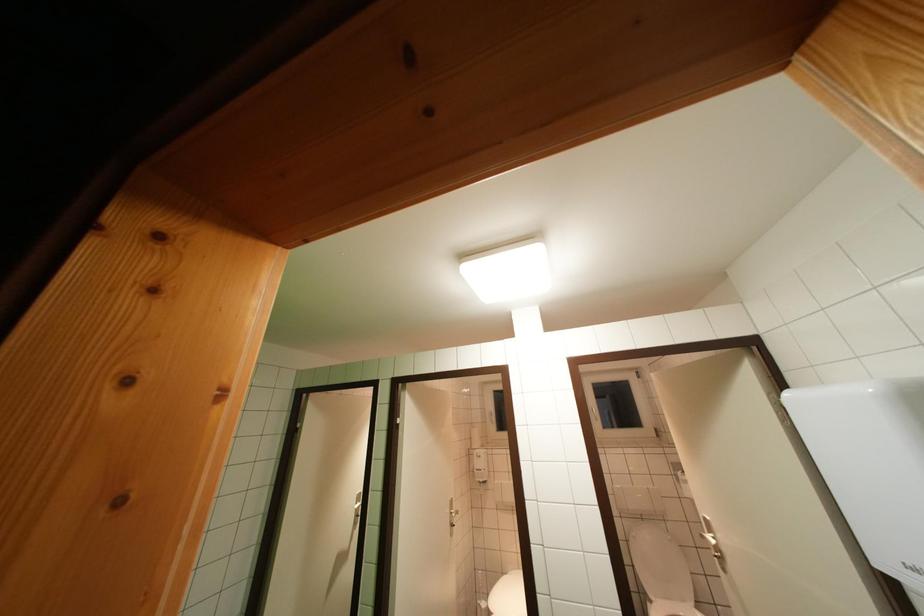
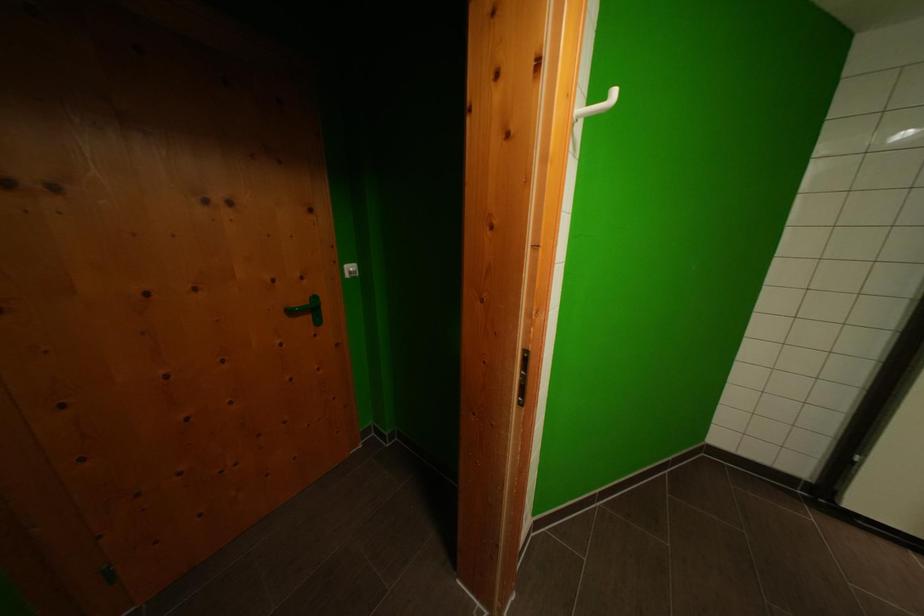
Question: The first image is from the beginning of the video and the second image is from the end. How did the camera likely rotate when shooting the video?

Choices:
 (A) Left
 (B) Right
 (C) Up
 (D) Down

Answer: (A)